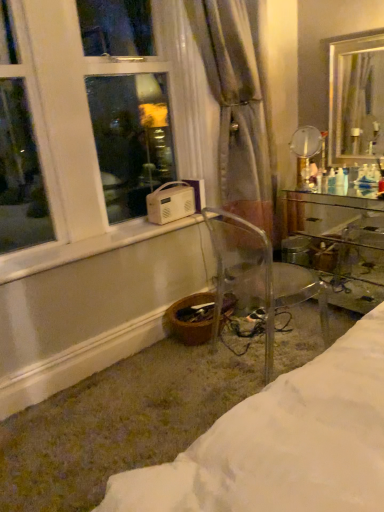
Image resolution: width=384 pixels, height=512 pixels. Describe the element at coordinates (74, 138) in the screenshot. I see `white plastic window at lower left` at that location.

Measure the distance between metallic gold mirror at upper right, arranged as the 1th mirror when viewed from the right, and camera.

metallic gold mirror at upper right, arranged as the 1th mirror when viewed from the right, and camera are 7.84 feet apart from each other.

What is the approximate height of transparent plastic chair at lower center?

transparent plastic chair at lower center is 34.02 inches tall.

What is the approximate height of translucent fabric curtain at center?

1.43 meters.

What is the approximate height of clear glass desk at right?

71.21 centimeters.

What do you see at coordinates (337, 244) in the screenshot? I see `clear glass desk at right` at bounding box center [337, 244].

Find the location of `clear glass mirror at upper right, marked as the 2th mirror in a right-to-left arrangement`. clear glass mirror at upper right, marked as the 2th mirror in a right-to-left arrangement is located at coordinates (305, 153).

Locate an element on the screen. The width and height of the screenshot is (384, 512). white plastic window at lower left is located at coordinates (74, 138).

Is clear glass mirror at upper right, acting as the 1th mirror starting from the left, in front of or behind translucent fabric curtain at center in the image?

clear glass mirror at upper right, acting as the 1th mirror starting from the left, is behind translucent fabric curtain at center.

In terms of size, does clear glass mirror at upper right, acting as the 1th mirror starting from the left, appear bigger or smaller than translucent fabric curtain at center?

Clearly, clear glass mirror at upper right, acting as the 1th mirror starting from the left, is smaller in size than translucent fabric curtain at center.

Is clear glass mirror at upper right, acting as the 1th mirror starting from the left, at the left side of translucent fabric curtain at center?

No.

Is there a large distance between clear glass mirror at upper right, marked as the 2th mirror in a right-to-left arrangement, and translucent fabric curtain at center?

No.

Is clear glass mirror at upper right, marked as the 2th mirror in a right-to-left arrangement, positioned with its back to transparent plastic chair at lower center?

clear glass mirror at upper right, marked as the 2th mirror in a right-to-left arrangement, is not turned away from transparent plastic chair at lower center.

Locate an element on the screen. chair located in front of the clear glass mirror at upper right, marked as the 2th mirror in a right-to-left arrangement is located at coordinates (258, 276).

From a real-world perspective, which is physically above, clear glass mirror at upper right, marked as the 2th mirror in a right-to-left arrangement, or transparent plastic chair at lower center?

clear glass mirror at upper right, marked as the 2th mirror in a right-to-left arrangement, from a real-world perspective.

What's the angular difference between clear glass mirror at upper right, acting as the 1th mirror starting from the left, and transparent plastic chair at lower center's facing directions?

There is a 155-degree angle between the facing directions of clear glass mirror at upper right, acting as the 1th mirror starting from the left, and transparent plastic chair at lower center.

Which object is wider, clear glass mirror at upper right, marked as the 2th mirror in a right-to-left arrangement, or clear glass desk at right?

clear glass desk at right is wider.

From a real-world perspective, is clear glass mirror at upper right, acting as the 1th mirror starting from the left, positioned over clear glass desk at right based on gravity?

Yes, from a real-world perspective, clear glass mirror at upper right, acting as the 1th mirror starting from the left, is over clear glass desk at right

Find the location of a particular element. The height and width of the screenshot is (512, 384). mirror that is the 1st object located above the clear glass desk at right (from the image's perspective) is located at coordinates (305, 153).

Consider the image. Is clear glass mirror at upper right, acting as the 1th mirror starting from the left, situated inside clear glass desk at right or outside?

clear glass mirror at upper right, acting as the 1th mirror starting from the left, is not inside clear glass desk at right, it's outside.

Is clear glass mirror at upper right, acting as the 1th mirror starting from the left, closer to camera compared to white plastic window at lower left?

No, the depth of clear glass mirror at upper right, acting as the 1th mirror starting from the left, is greater than that of white plastic window at lower left.

Does clear glass mirror at upper right, marked as the 2th mirror in a right-to-left arrangement, contain white plastic window at lower left?

No, clear glass mirror at upper right, marked as the 2th mirror in a right-to-left arrangement, does not contain white plastic window at lower left.

Does point (305, 179) appear closer or farther from the camera than point (90, 217)?

Point (305, 179) appears to be farther away from the viewer than point (90, 217).

Is clear glass mirror at upper right, acting as the 1th mirror starting from the left, taller or shorter than white plastic window at lower left?

Clearly, clear glass mirror at upper right, acting as the 1th mirror starting from the left, is shorter compared to white plastic window at lower left.

Is transparent plastic chair at lower center facing towards clear glass mirror at upper right, marked as the 2th mirror in a right-to-left arrangement?

Yes, transparent plastic chair at lower center is oriented towards clear glass mirror at upper right, marked as the 2th mirror in a right-to-left arrangement.

How much distance is there between transparent plastic chair at lower center and clear glass mirror at upper right, acting as the 1th mirror starting from the left?

transparent plastic chair at lower center is 83.14 centimeters from clear glass mirror at upper right, acting as the 1th mirror starting from the left.

Locate an element on the screen. chair in front of the clear glass mirror at upper right, acting as the 1th mirror starting from the left is located at coordinates (258, 276).

What's the angular difference between transparent plastic chair at lower center and clear glass mirror at upper right, acting as the 1th mirror starting from the left,'s facing directions?

The facing directions of transparent plastic chair at lower center and clear glass mirror at upper right, acting as the 1th mirror starting from the left, are 155 degrees apart.

From a real-world perspective, is translucent fabric curtain at center over clear glass mirror at upper right, marked as the 2th mirror in a right-to-left arrangement?

Yes, from a real-world perspective, translucent fabric curtain at center is on top of clear glass mirror at upper right, marked as the 2th mirror in a right-to-left arrangement.

Are translucent fabric curtain at center and clear glass mirror at upper right, marked as the 2th mirror in a right-to-left arrangement, making contact?

translucent fabric curtain at center and clear glass mirror at upper right, marked as the 2th mirror in a right-to-left arrangement, are clearly separated.

Is translucent fabric curtain at center oriented away from clear glass mirror at upper right, marked as the 2th mirror in a right-to-left arrangement?

That's not correct — translucent fabric curtain at center is not looking away from clear glass mirror at upper right, marked as the 2th mirror in a right-to-left arrangement.

From a real-world perspective, is clear glass desk at right physically located above or below clear glass mirror at upper right, marked as the 2th mirror in a right-to-left arrangement?

Clearly, from a real-world perspective, clear glass desk at right is below clear glass mirror at upper right, marked as the 2th mirror in a right-to-left arrangement.

Could you tell me if clear glass desk at right is facing clear glass mirror at upper right, marked as the 2th mirror in a right-to-left arrangement?

No, clear glass desk at right is not facing towards clear glass mirror at upper right, marked as the 2th mirror in a right-to-left arrangement.

Measure the distance between clear glass desk at right and clear glass mirror at upper right, acting as the 1th mirror starting from the left.

A distance of 20.43 inches exists between clear glass desk at right and clear glass mirror at upper right, acting as the 1th mirror starting from the left.

You are a GUI agent. You are given a task and a screenshot of the screen. Output one action in this format:
    pyautogui.click(x=<x>, y=<y>)
    Task: Click on the desk below the clear glass mirror at upper right, marked as the 2th mirror in a right-to-left arrangement (from the image's perspective)
    This screenshot has width=384, height=512.
    Given the screenshot: What is the action you would take?
    pyautogui.click(x=337, y=244)

The height and width of the screenshot is (512, 384). Find the location of `curtain on the left of clear glass mirror at upper right, acting as the 1th mirror starting from the left`. curtain on the left of clear glass mirror at upper right, acting as the 1th mirror starting from the left is located at coordinates pyautogui.click(x=239, y=106).

I want to click on the 1st mirror positioned above the transparent plastic chair at lower center (from the image's perspective), so click(305, 153).

From the image, which object appears to be farther from translucent fabric curtain at center, metallic gold mirror at upper right, arranged as the 1th mirror when viewed from the right, or clear glass desk at right?

The object further to translucent fabric curtain at center is metallic gold mirror at upper right, arranged as the 1th mirror when viewed from the right.

Considering their positions, is transparent plastic chair at lower center positioned closer to translucent fabric curtain at center than clear glass desk at right?

transparent plastic chair at lower center is closer to translucent fabric curtain at center.

From the image, which object appears to be nearer to clear glass desk at right, metallic gold mirror at upper right, the second mirror in the left-to-right sequence, or clear glass mirror at upper right, marked as the 2th mirror in a right-to-left arrangement?

clear glass mirror at upper right, marked as the 2th mirror in a right-to-left arrangement, is closer to clear glass desk at right.

From the image, which object appears to be nearer to clear glass mirror at upper right, marked as the 2th mirror in a right-to-left arrangement, white plastic window at lower left or transparent plastic chair at lower center?

The object closer to clear glass mirror at upper right, marked as the 2th mirror in a right-to-left arrangement, is transparent plastic chair at lower center.

Considering their positions, is clear glass mirror at upper right, acting as the 1th mirror starting from the left, positioned closer to white plastic window at lower left than translucent fabric curtain at center?

Based on the image, translucent fabric curtain at center appears to be nearer to white plastic window at lower left.

Estimate the real-world distances between objects in this image. Which object is further from metallic gold mirror at upper right, the second mirror in the left-to-right sequence, transparent plastic chair at lower center or clear glass desk at right?

Based on the image, transparent plastic chair at lower center appears to be further to metallic gold mirror at upper right, the second mirror in the left-to-right sequence.

From the image, which object appears to be nearer to clear glass mirror at upper right, acting as the 1th mirror starting from the left, clear glass desk at right or metallic gold mirror at upper right, arranged as the 1th mirror when viewed from the right?

Among the two, metallic gold mirror at upper right, arranged as the 1th mirror when viewed from the right, is located nearer to clear glass mirror at upper right, acting as the 1th mirror starting from the left.

When comparing their distances from white plastic window at lower left, does clear glass desk at right or translucent fabric curtain at center seem further?

Based on the image, clear glass desk at right appears to be further to white plastic window at lower left.

Find the location of a particular element. The width and height of the screenshot is (384, 512). curtain situated between white plastic window at lower left and clear glass desk at right from left to right is located at coordinates (239, 106).

Where is `window between translucent fabric curtain at center and transparent plastic chair at lower center in the up-down direction`? This screenshot has width=384, height=512. window between translucent fabric curtain at center and transparent plastic chair at lower center in the up-down direction is located at coordinates (74, 138).

The image size is (384, 512). Identify the location of mirror between translucent fabric curtain at center and transparent plastic chair at lower center in the vertical direction. (305, 153).

Where is `desk between metallic gold mirror at upper right, the second mirror in the left-to-right sequence, and transparent plastic chair at lower center, in the vertical direction`? The image size is (384, 512). desk between metallic gold mirror at upper right, the second mirror in the left-to-right sequence, and transparent plastic chair at lower center, in the vertical direction is located at coordinates (337, 244).